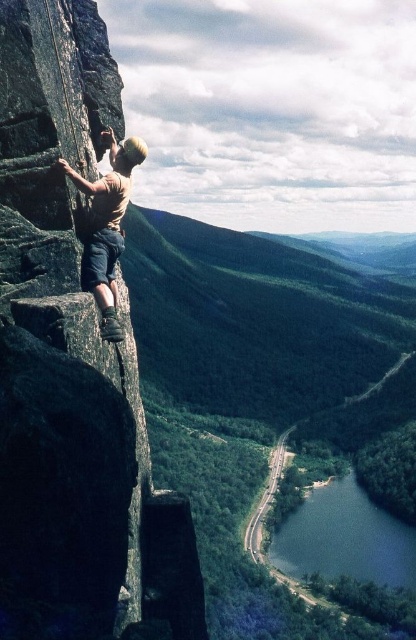
You are a photographer positioned to capture the climber and the surrounding environment. You notice the smooth gray rock at left and the light brown fabric shirt at left in your frame. Which object is positioned more to the right in the image?

The smooth gray rock at left is positioned more to the right than the light brown fabric shirt at left in the image.

You are standing at the base of the cliff and want to reach the point marked at coordinates point (66, 468). If you can climb 1.5 meters per minute, how long will it take you to reach that point?

The point marked at coordinates point (66, 468) is 13.49 meters away from the viewer. At a climbing rate of 1.5 meters per minute, it would take approximately 9 minutes to reach that point.

You are a photographer standing at the base of the cliff. You want to capture a photo of the light brown fabric shirt at left and the smooth gray rock at left. Which object should you focus on first if you want to include both in the frame without moving the camera?

The smooth gray rock at left is much taller than the light brown fabric shirt at left, so you should focus on the smooth gray rock at left first to ensure it fits in the frame.